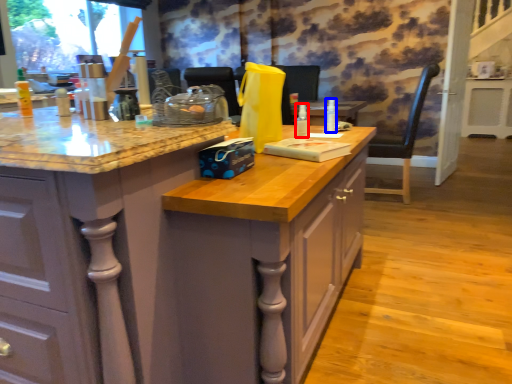
Question: Which point is closer to the camera, bottle (highlighted by a red box) or bottle (highlighted by a blue box)?

Choices:
 (A) bottle
 (B) bottle

Answer: (A)